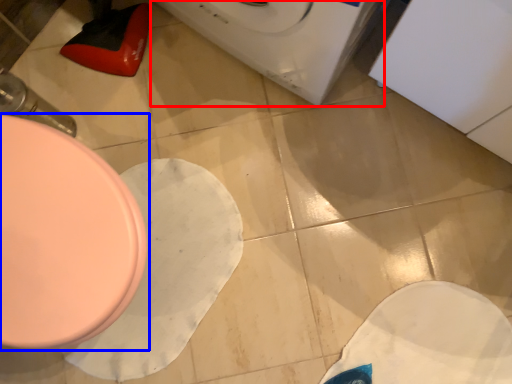
Question: Which of the following is the closest to the observer, washing machine (highlighted by a red box) or toilet (highlighted by a blue box)?

Choices:
 (A) washing machine
 (B) toilet

Answer: (A)